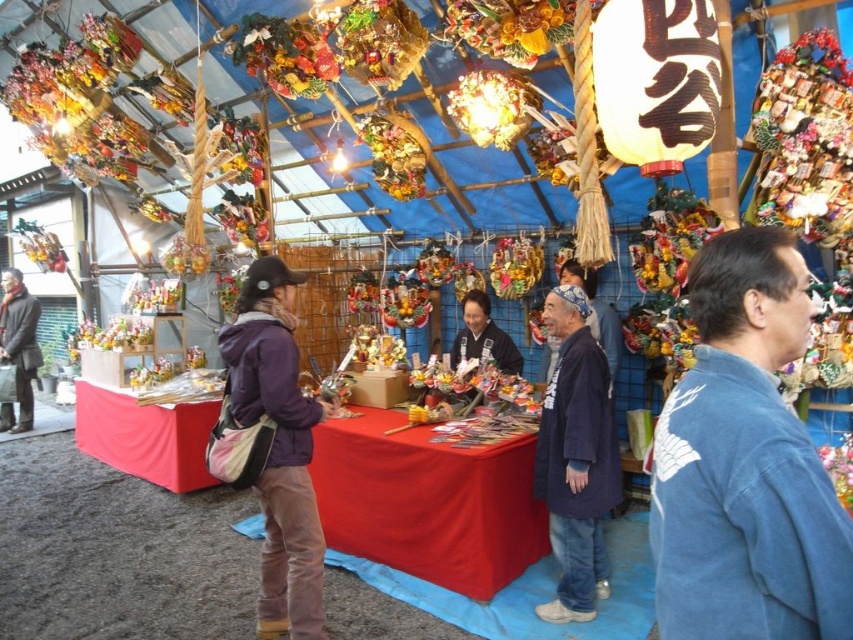
You are a customer at the market and want to pick up both the blue denim jacket at lower right and the blue cotton kimono at center. Which item should you reach for first to ensure you can easily access both?

The blue denim jacket at lower right is closer to the viewer than the blue cotton kimono at center, so you should reach for the blue denim jacket at lower right first to access it easily before reaching for the blue cotton kimono at center.

You are a vendor at the market and need to place a new item on the table between the blue cotton kimono at center and the dark blue fabric at center. The item is 2 feet wide. Can it fit in the space between them?

The blue cotton kimono at center and dark blue fabric at center are 3.39 feet apart from each other. Since the item is 2 feet wide, it can fit in the space between them as there is enough room.

You are a vendor at the market and want to place a new item on the table. You have a small box that is 20 cm in length. The purple fleece jacket at center and the dark blue fabric at center are already on the table. Which object can the small box be placed next to without overlapping?

The small box can be placed next to the dark blue fabric at center because the purple fleece jacket at center is larger in size and may take up more space, leaving limited room next to it. The dark blue fabric at center is smaller, so there is more space available there.